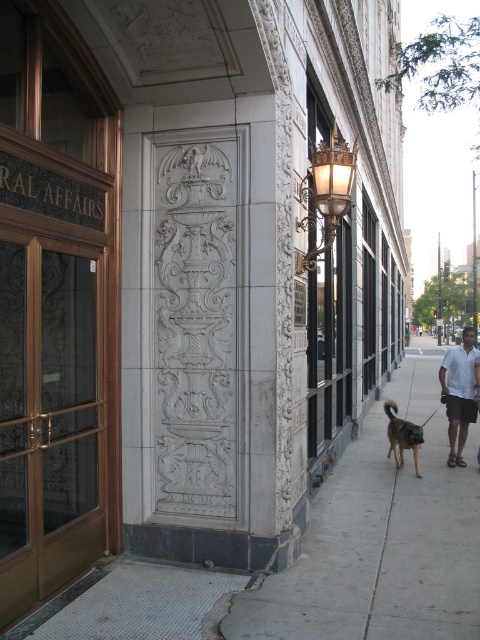
Looking at this image, does white cotton shirt at right appear on the left side of brown fur dog at lower center?

In fact, white cotton shirt at right is to the right of brown fur dog at lower center.

Does white cotton shirt at right appear under brown fur dog at lower center?

Incorrect, white cotton shirt at right is not positioned below brown fur dog at lower center.

This screenshot has width=480, height=640. Describe the element at coordinates (458, 392) in the screenshot. I see `white cotton shirt at right` at that location.

Locate an element on the screen. white cotton shirt at right is located at coordinates (458, 392).

Can you confirm if gray concrete sidewalk at center is thinner than white cotton shirt at right?

Indeed, gray concrete sidewalk at center has a lesser width compared to white cotton shirt at right.

Is gray concrete sidewalk at center taller than white cotton shirt at right?

No.

Which is in front, point (338, 508) or point (452, 372)?

Point (338, 508)

I want to click on gray concrete sidewalk at center, so 379,550.

Which of these two, gray concrete sidewalk at center or brown fur dog at lower center, stands shorter?

With less height is gray concrete sidewalk at center.

Between point (419, 573) and point (403, 458), which one is positioned behind?

Positioned behind is point (403, 458).

Identify the location of gray concrete sidewalk at center. (379, 550).